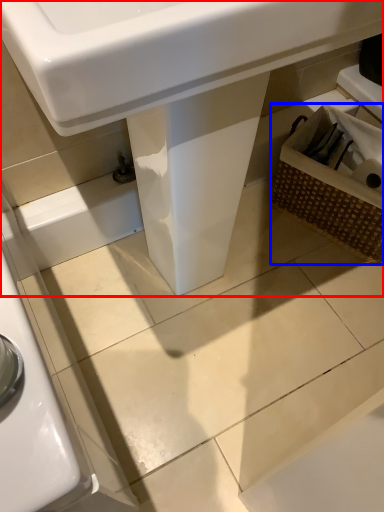
Question: Which object is further to the camera taking this photo, sink (highlighted by a red box) or basket (highlighted by a blue box)?

Choices:
 (A) sink
 (B) basket

Answer: (B)